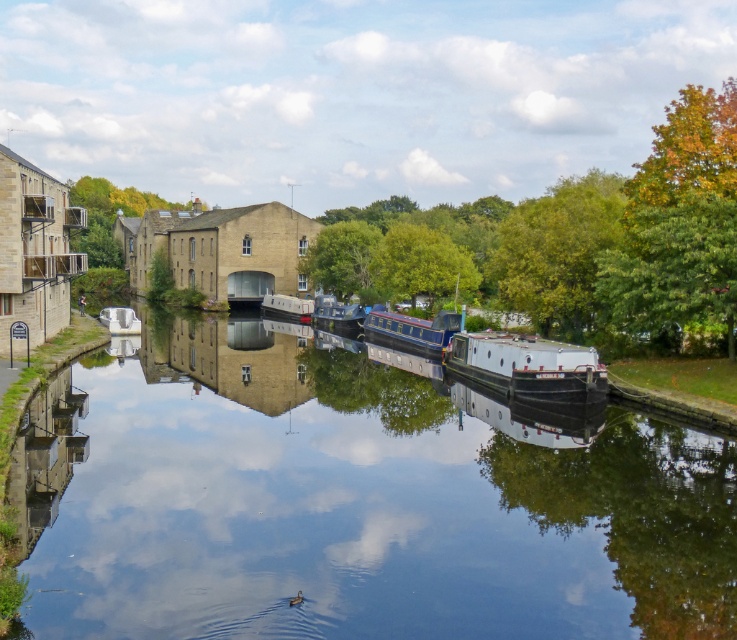
Which is below, white glossy canal boat at center or metallic silver boat at left?

Positioned lower is metallic silver boat at left.

Is white glossy canal boat at center to the right of metallic silver boat at left from the viewer's perspective?

Indeed, white glossy canal boat at center is positioned on the right side of metallic silver boat at left.

Which is behind, point (265, 316) or point (136, 321)?

Point (265, 316)

Locate an element on the screen. Image resolution: width=737 pixels, height=640 pixels. white glossy canal boat at center is located at coordinates (286, 307).

Describe the element at coordinates (352, 500) in the screenshot. This screenshot has height=640, width=737. I see `clear water at center` at that location.

From the picture: Can you confirm if clear water at center is positioned below blue polished wood barge at center?

Yes.

Locate an element on the screen. The width and height of the screenshot is (737, 640). clear water at center is located at coordinates (352, 500).

Locate an element on the screen. The height and width of the screenshot is (640, 737). clear water at center is located at coordinates (352, 500).

Can you confirm if white matte boat at center is positioned to the right of white glossy canal boat at center?

Yes, white matte boat at center is to the right of white glossy canal boat at center.

Who is more forward, (506, 365) or (303, 310)?

Point (506, 365)

Who is more forward, (584, 372) or (312, 307)?

Point (584, 372) is more forward.

Locate an element on the screen. white matte boat at center is located at coordinates (528, 365).